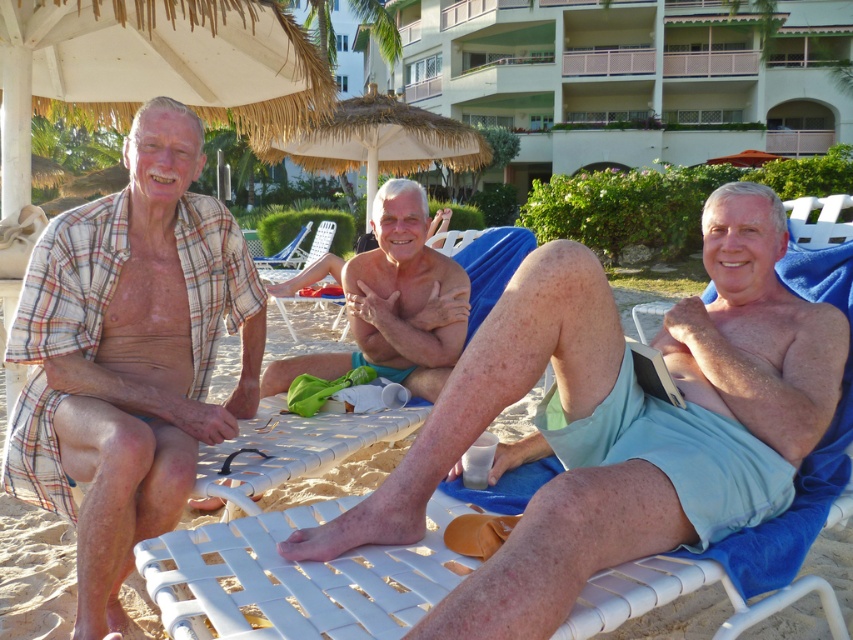
You are a lifeguard on duty at the beach. You notice two men wearing light blue fabric shorts at center. How far apart are they?

The two men wearing light blue fabric shorts at center are 3.42 feet apart.

You are standing at the origin of the coordinate system. There is a point at coordinates point (492, 390). Which object is this point located on?

The point (492, 390) is located on the light blue fabric shorts at center.